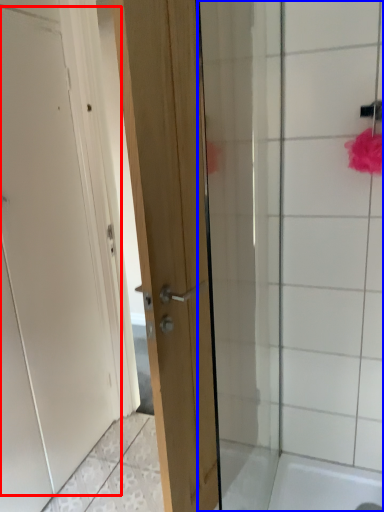
Question: Which point is closer to the camera, door (highlighted by a red box) or shower door (highlighted by a blue box)?

Choices:
 (A) door
 (B) shower door

Answer: (A)